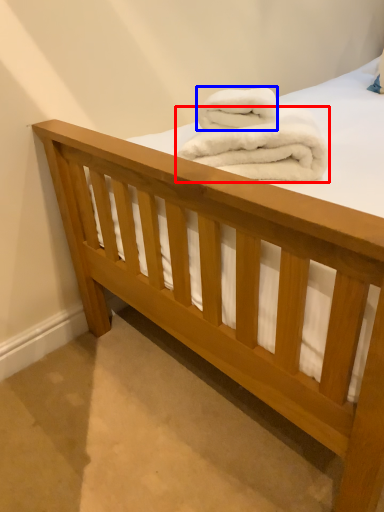
Question: Which object appears farthest to the camera in this image, towel (highlighted by a red box) or towel (highlighted by a blue box)?

Choices:
 (A) towel
 (B) towel

Answer: (B)